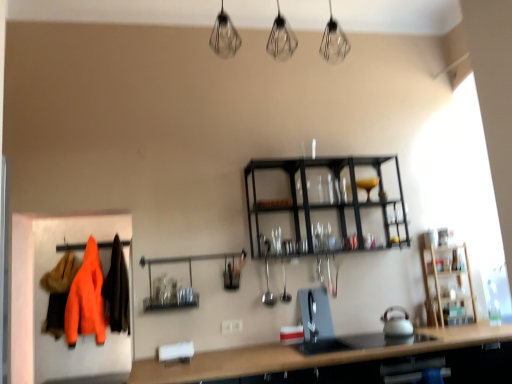
Identify the location of metallic glassware at center. (151, 289).

This screenshot has width=512, height=384. What do you see at coordinates (151, 289) in the screenshot?
I see `metallic glassware at center` at bounding box center [151, 289].

Measure the distance between metallic glassware at center and camera.

The depth of metallic glassware at center is 3.12 meters.

What do you see at coordinates (88, 296) in the screenshot? This screenshot has width=512, height=384. I see `orange fabric coat at left` at bounding box center [88, 296].

At what (x,y) coordinates should I click in order to perform the action: click on orange fabric coat at left. Please return your answer as a coordinate pair (x, y). This screenshot has width=512, height=384. Looking at the image, I should click on (88, 296).

Find the location of a particular element. metallic glassware at center is located at coordinates (151, 289).

Considering the relative positions of orange fabric coat at left and metallic glassware at center in the image provided, is orange fabric coat at left to the right of metallic glassware at center from the viewer's perspective?

Incorrect, orange fabric coat at left is not on the right side of metallic glassware at center.

Which object is closer to the camera, orange fabric coat at left or metallic glassware at center?

metallic glassware at center is in front.

Does point (95, 301) appear closer or farther from the camera than point (162, 262)?

Point (95, 301) is positioned farther from the camera compared to point (162, 262).

From the image's perspective, is orange fabric coat at left over metallic glassware at center?

Actually, orange fabric coat at left appears below metallic glassware at center in the image.

From a real-world perspective, is orange fabric coat at left located beneath metallic glassware at center?

Yes, from a real-world perspective, orange fabric coat at left is below metallic glassware at center.

Considering the relative sizes of orange fabric coat at left and metallic glassware at center in the image provided, is orange fabric coat at left thinner than metallic glassware at center?

Yes.

From the picture: Does orange fabric coat at left have a greater height compared to metallic glassware at center?

Yes.

Does orange fabric coat at left have a larger size compared to metallic glassware at center?

Indeed, orange fabric coat at left has a larger size compared to metallic glassware at center.

Consider the image. Choose the correct answer: Is orange fabric coat at left inside metallic glassware at center or outside it?

orange fabric coat at left is not enclosed by metallic glassware at center.

Is orange fabric coat at left placed right next to metallic glassware at center?

orange fabric coat at left and metallic glassware at center are not in contact.

Is orange fabric coat at left oriented towards metallic glassware at center?

No.

Measure the distance between orange fabric coat at left and metallic glassware at center.

A distance of 5.35 feet exists between orange fabric coat at left and metallic glassware at center.

Identify the location of clothing behind the metallic glassware at center. Image resolution: width=512 pixels, height=384 pixels. (88, 296).

Is metallic glassware at center to the right of orange fabric coat at left from the viewer's perspective?

Yes.

In the image, is metallic glassware at center positioned in front of or behind orange fabric coat at left?

metallic glassware at center is in front of orange fabric coat at left.

Considering the positions of points (188, 305) and (91, 308), is point (188, 305) farther from camera compared to point (91, 308)?

No, (188, 305) is closer to viewer.

From the image's perspective, is metallic glassware at center located beneath orange fabric coat at left?

Incorrect, from the image's perspective, metallic glassware at center is higher than orange fabric coat at left.

From a real-world perspective, between metallic glassware at center and orange fabric coat at left, who is vertically higher?

In real-world perspective, metallic glassware at center is above.

Which object is wider, metallic glassware at center or orange fabric coat at left?

metallic glassware at center is wider.

Does metallic glassware at center have a lesser height compared to orange fabric coat at left?

Indeed, metallic glassware at center has a lesser height compared to orange fabric coat at left.

Which of these two, metallic glassware at center or orange fabric coat at left, is bigger?

Bigger between the two is orange fabric coat at left.

Which is correct: metallic glassware at center is inside orange fabric coat at left, or outside of it?

metallic glassware at center is spatially situated outside orange fabric coat at left.

Is metallic glassware at center not near orange fabric coat at left?

metallic glassware at center is far away from orange fabric coat at left.

Is metallic glassware at center facing away from orange fabric coat at left?

No, metallic glassware at center's orientation is not away from orange fabric coat at left.

How different are the orientations of metallic glassware at center and orange fabric coat at left in degrees?

The angle between the facing direction of metallic glassware at center and the facing direction of orange fabric coat at left is 0.000166 degrees.

Where is `clothing behind the metallic glassware at center`? The width and height of the screenshot is (512, 384). clothing behind the metallic glassware at center is located at coordinates (88, 296).

The height and width of the screenshot is (384, 512). What are the coordinates of `clothing below the metallic glassware at center (from the image's perspective)` in the screenshot? It's located at (88, 296).

The image size is (512, 384). Find the location of `shelf above the orange fabric coat at left (from the image's perspective)`. shelf above the orange fabric coat at left (from the image's perspective) is located at coordinates (151, 289).